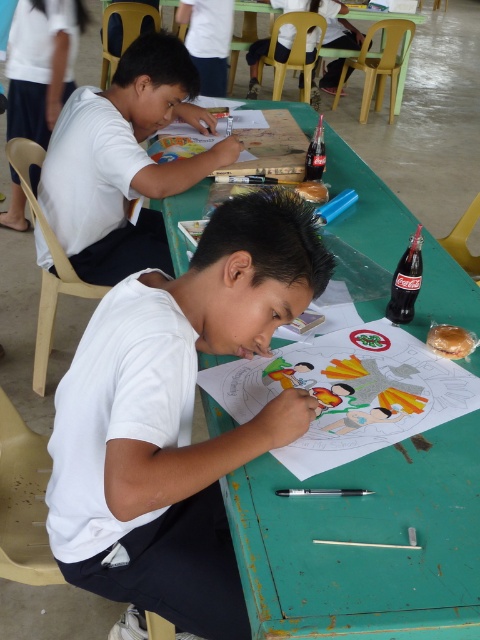
Does point (469, 586) lie behind point (82, 268)?

No, it is in front of (82, 268).

In the scene shown: Does green painted wood table at center appear over white matte shirt at upper left?

No.

Who is more forward, (287, 618) or (57, 147)?

Positioned in front is point (287, 618).

Identify the location of green painted wood table at center. (365, 540).

Locate an element on the screen. This screenshot has height=640, width=480. white paper at center is located at coordinates (177, 417).

Where is `white paper at center`? The image size is (480, 640). white paper at center is located at coordinates (177, 417).

Does white paper at center appear on the left side of green painted wood table at center?

Indeed, white paper at center is positioned on the left side of green painted wood table at center.

Can you confirm if white paper at center is smaller than green painted wood table at center?

Indeed, white paper at center has a smaller size compared to green painted wood table at center.

Is point (115, 349) farther from viewer compared to point (196, 212)?

That is False.

Locate an element on the screen. This screenshot has height=640, width=480. white paper at center is located at coordinates (177, 417).